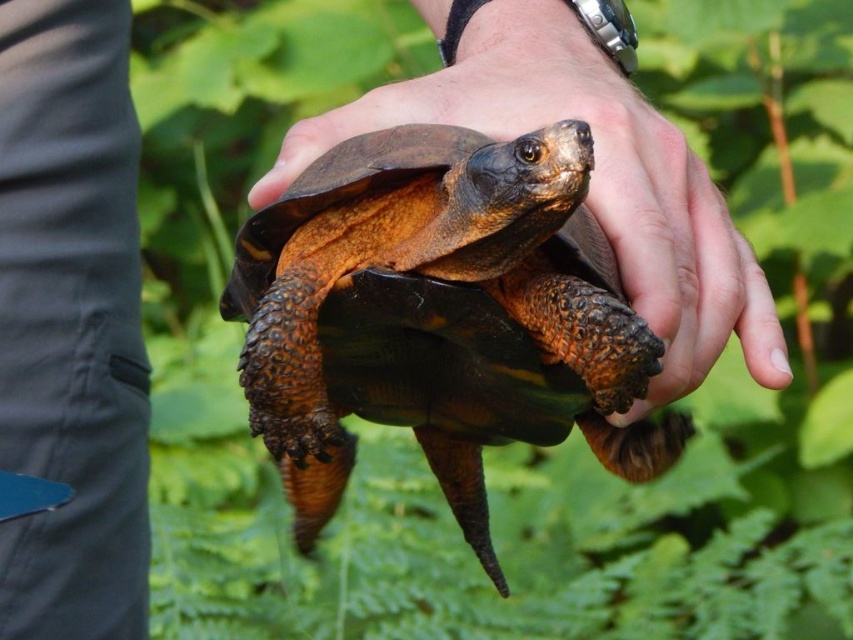
Can you confirm if brown rough textured tortoise at center is positioned above brown rough skin at center?

No.

Is brown rough textured tortoise at center smaller than brown rough skin at center?

Actually, brown rough textured tortoise at center might be larger than brown rough skin at center.

Identify the location of brown rough textured tortoise at center. (440, 316).

Where is `brown rough textured tortoise at center`? brown rough textured tortoise at center is located at coordinates (440, 316).